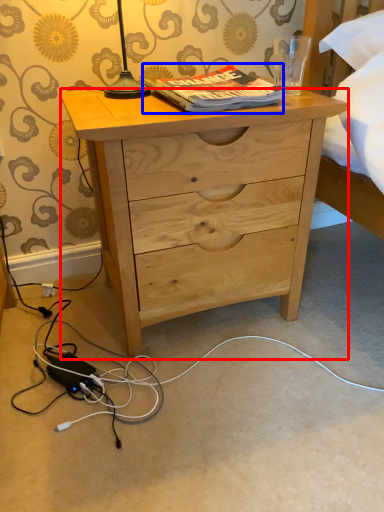
Question: Which object is closer to the camera taking this photo, desk (highlighted by a red box) or book (highlighted by a blue box)?

Choices:
 (A) desk
 (B) book

Answer: (A)